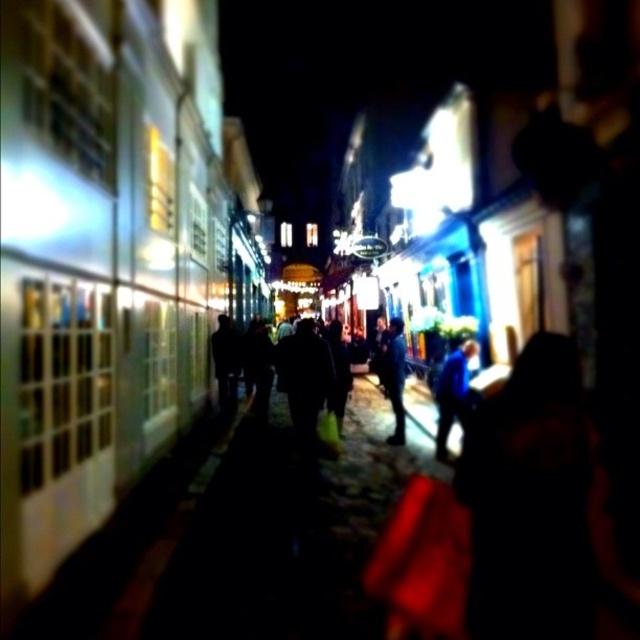
Is point (461, 342) farther from camera compared to point (394, 432)?

That is True.

Is blue fabric jacket at center bigger than dark blue jacket at center?

Indeed, blue fabric jacket at center has a larger size compared to dark blue jacket at center.

In order to click on blue fabric jacket at center in this screenshot , I will do `click(452, 394)`.